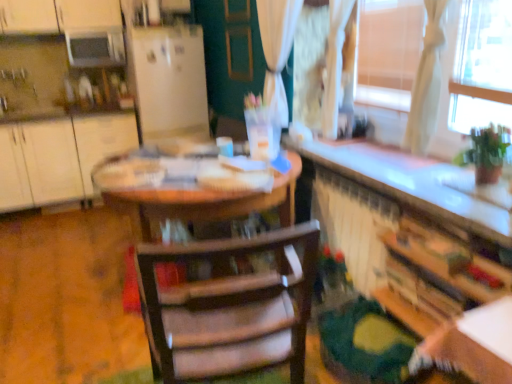
Question: Which is correct: white matte cabinet at left, which is the first cabinetry in top-to-bottom order, is inside wooden chair at center, or outside of it?

Choices:
 (A) outside
 (B) inside

Answer: (A)

Question: Is point (15, 206) closer or farther from the camera than point (289, 248)?

Choices:
 (A) closer
 (B) farther

Answer: (B)

Question: Which is farther from the white glossy microwave at upper left?

Choices:
 (A) matte brown screen door at center
 (B) wooden bookshelf at lower right, placed as the 2th cabinetry when sorted from left to right
 (C) white matte refrigerator at center
 (D) white matte cabinet at left, the 2th cabinetry from the front
 (E) wooden chair at center

Answer: (B)

Question: Estimate the real-world distances between objects in this image. Which object is closer to the wooden chair at center?

Choices:
 (A) white matte cabinet at left, the 1th cabinetry positioned from the left
 (B) wooden bookshelf at lower right, placed as the 1th cabinetry when sorted from right to left
 (C) white glossy microwave at upper left
 (D) white matte refrigerator at center
 (E) matte brown screen door at center

Answer: (B)